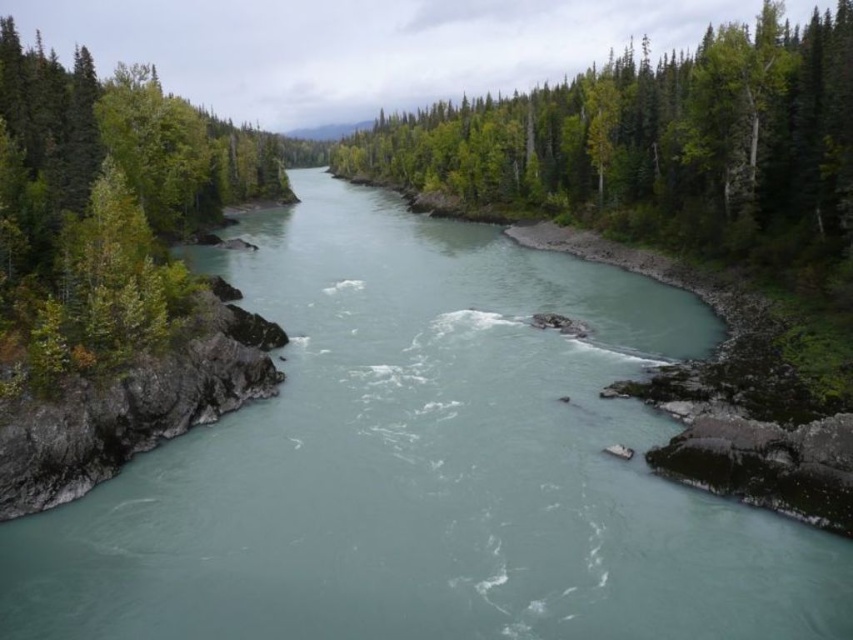
Question: Considering the real-world distances, which object is closest to the green leafy trees at center?

Choices:
 (A) greenish-blue water at center
 (B) green leafy tree at left

Answer: (B)

Question: Does greenish-blue water at center appear under green leafy tree at left?

Choices:
 (A) yes
 (B) no

Answer: (A)

Question: Which object appears farthest from the camera in this image?

Choices:
 (A) green leafy tree at left
 (B) green leafy trees at center

Answer: (B)

Question: In this image, where is greenish-blue water at center located relative to green leafy trees at center?

Choices:
 (A) below
 (B) above

Answer: (A)

Question: Estimate the real-world distances between objects in this image. Which object is farther from the greenish-blue water at center?

Choices:
 (A) green leafy tree at left
 (B) green leafy trees at center

Answer: (B)

Question: Is green leafy trees at center positioned behind green leafy tree at left?

Choices:
 (A) no
 (B) yes

Answer: (B)